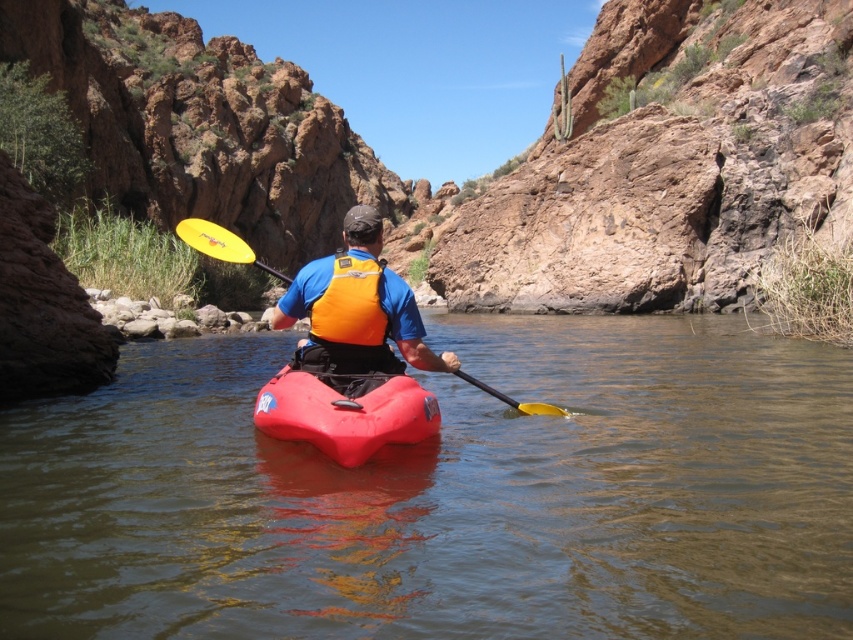
Question: Which object is closer to the camera taking this photo?

Choices:
 (A) yellow plastic paddle at center
 (B) orange/yellow fabric life jacket at center

Answer: (A)

Question: Which object is the closest to the smooth plastic kayak at center?

Choices:
 (A) yellow plastic paddle at center
 (B) matte plastic canoe at center
 (C) matte orange life vest at center
 (D) orange/yellow fabric life jacket at center

Answer: (B)

Question: Where is matte orange life vest at center located in relation to orange/yellow fabric life jacket at center in the image?

Choices:
 (A) right
 (B) left

Answer: (A)

Question: Is smooth plastic kayak at center behind matte orange life vest at center?

Choices:
 (A) no
 (B) yes

Answer: (A)

Question: Which point appears farthest from the camera in this image?

Choices:
 (A) (173, 442)
 (B) (421, 356)

Answer: (A)

Question: Does matte plastic canoe at center appear over orange/yellow fabric life jacket at center?

Choices:
 (A) no
 (B) yes

Answer: (A)